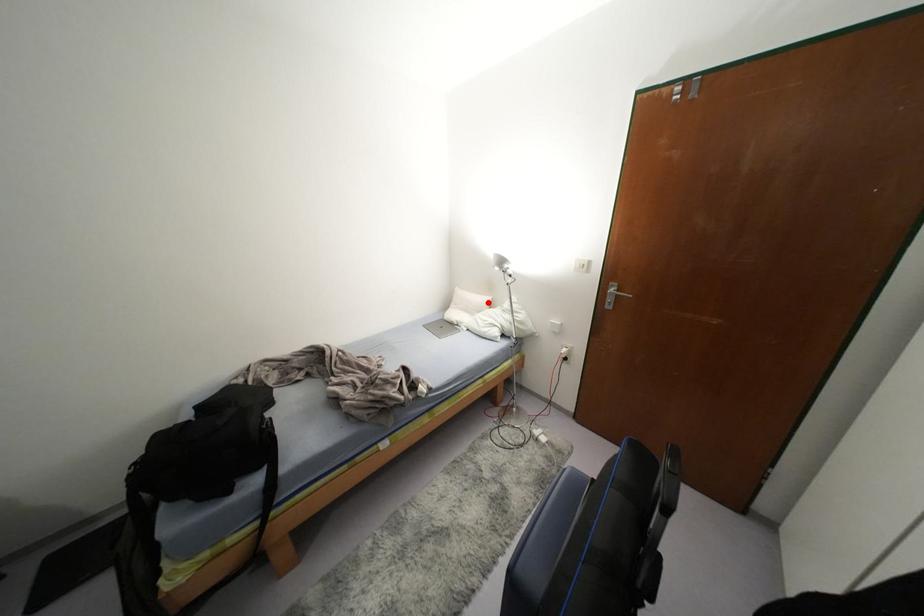
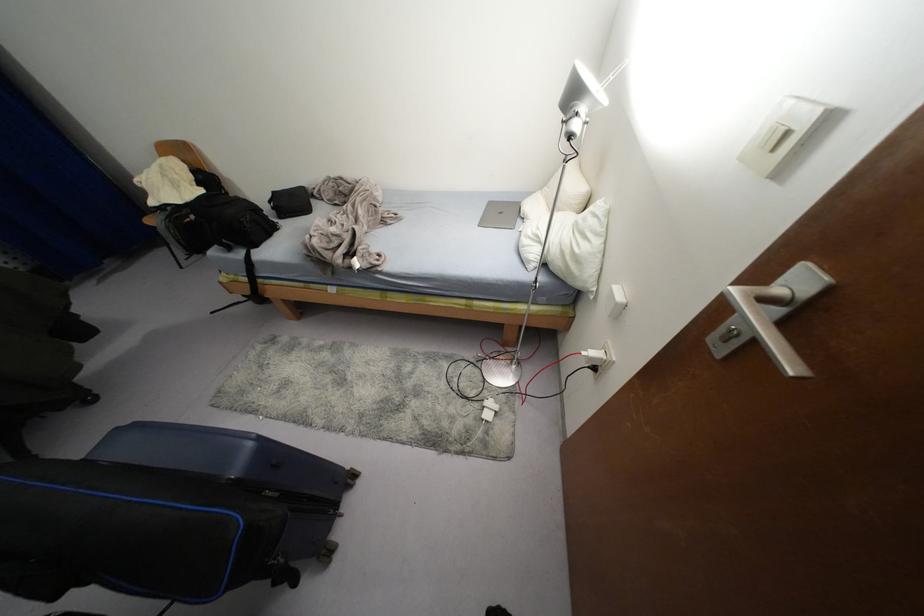
The point at the highlighted location is marked in the first image. Where is the corresponding point in the second image?

(579, 201)